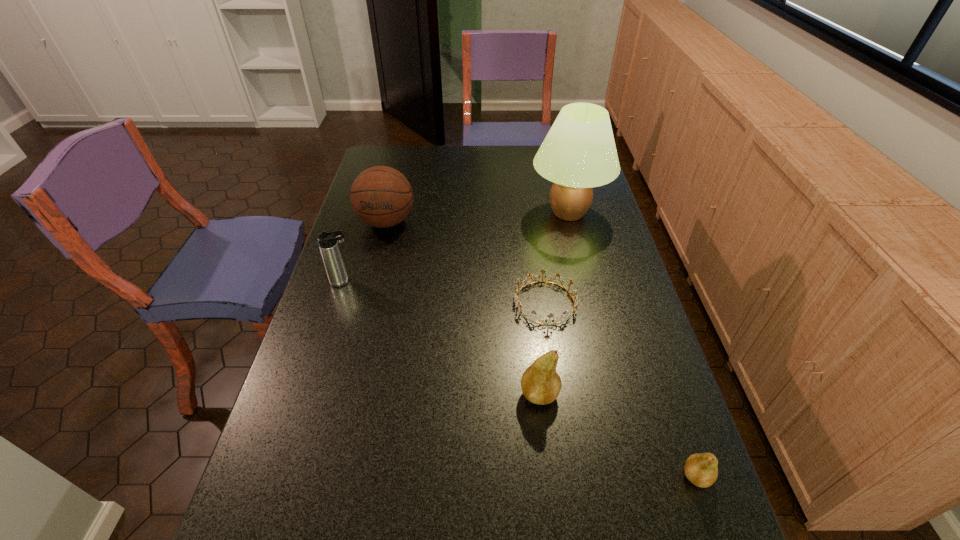
You are a GUI agent. You are given a task and a screenshot of the screen. Output one action in this format:
    pyautogui.click(x=<x>, y=<y>)
    Task: Click on the lampshade that is at the right edge
    
    Given the screenshot: What is the action you would take?
    pyautogui.click(x=579, y=152)

Locate an element on the screen. The height and width of the screenshot is (540, 960). object that is at the near right corner is located at coordinates (701, 469).

Where is `free space at the far edge`? The width and height of the screenshot is (960, 540). free space at the far edge is located at coordinates (408, 173).

Identify the location of vacant space at the near edge of the desktop. The width and height of the screenshot is (960, 540). (396, 497).

In the image, there is a desktop. What are the coordinates of `blank space at the left edge` in the screenshot? It's located at (350, 366).

In the image, there is a desktop. Where is `vacant space at the right edge`? The width and height of the screenshot is (960, 540). vacant space at the right edge is located at coordinates (630, 292).

This screenshot has height=540, width=960. What are the coordinates of `free space at the near left corner of the desktop` in the screenshot? It's located at (292, 501).

This screenshot has width=960, height=540. I want to click on free spot between the basketball and the tiara, so click(466, 262).

At what (x,y) coordinates should I click in order to perform the action: click on blank region between the nearer pear and the tallest object. Please return your answer as a coordinate pair (x, y). This screenshot has height=540, width=960. Looking at the image, I should click on (633, 345).

Locate an element on the screen. vacant point located between the shorter pear and the farther pear is located at coordinates (618, 435).